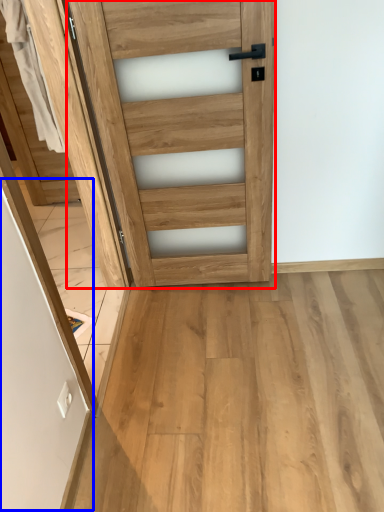
Question: Which object appears farthest to the camera in this image, door (highlighted by a red box) or screen door (highlighted by a blue box)?

Choices:
 (A) door
 (B) screen door

Answer: (B)